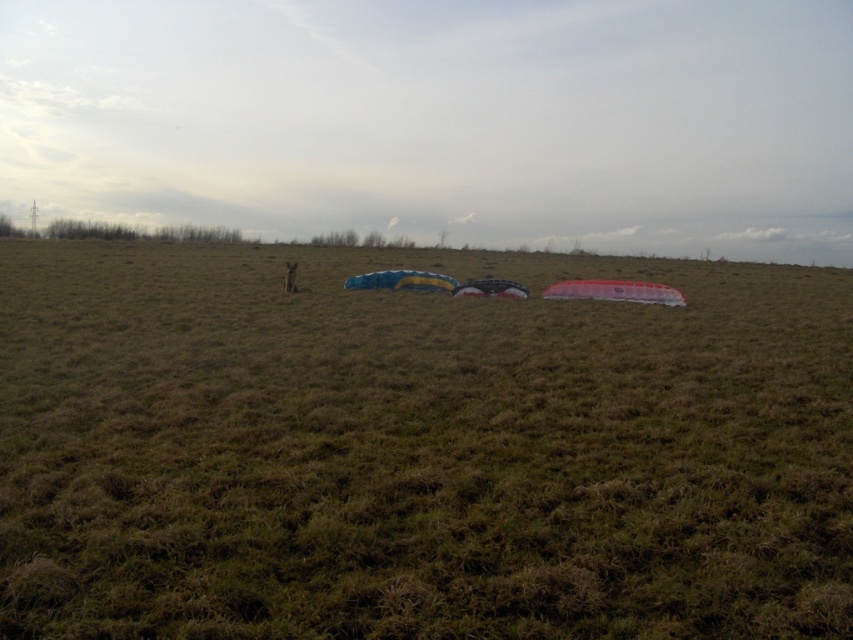
Is point (606, 573) positioned behind point (495, 289)?

No, it is not.

Locate an element on the screen. brown grassy field at center is located at coordinates (416, 449).

What do you see at coordinates (416, 449) in the screenshot?
I see `brown grassy field at center` at bounding box center [416, 449].

What are the coordinates of `brown grassy field at center` in the screenshot? It's located at pos(416,449).

This screenshot has height=640, width=853. In order to click on brown grassy field at center in this screenshot , I will do `click(416, 449)`.

Can you confirm if transparent plastic kite at center is bigger than translucent black kite at center?

Yes.

Is point (630, 296) closer to camera compared to point (485, 282)?

Yes, it is in front of point (485, 282).

Measure the distance between point [612,294] and camera.

Point [612,294] and camera are 20.75 meters apart.

Find the location of a particular element. transparent plastic kite at center is located at coordinates point(614,291).